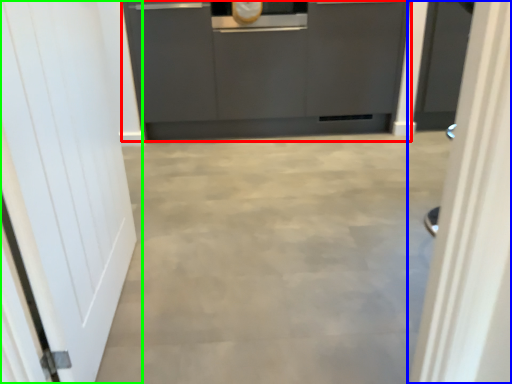
Question: Considering the real-world distances, which object is closest to cabinetry (highlighted by a red box)? door (highlighted by a blue box) or door (highlighted by a green box).

Choices:
 (A) door
 (B) door

Answer: (B)